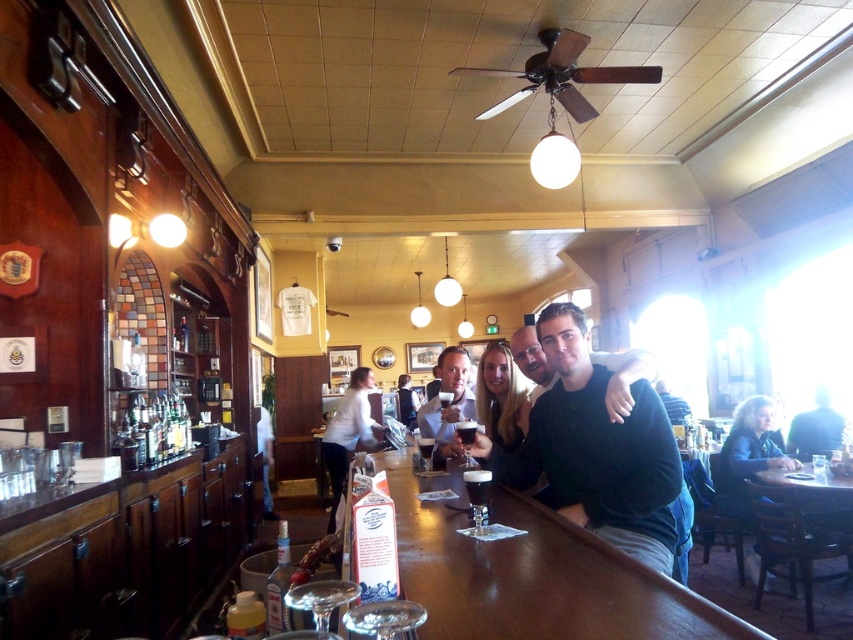
You are a bartender who needs to hand a drink to both the white matte shirt at bar and the matte black shirt at center. Which customer should you serve first if you want to minimize the distance walked?

The white matte shirt at bar is closer to you than the matte black shirt at center, so you should serve the white matte shirt at bar first to minimize the distance walked.

You are a bartender who needs to place a 3.5 feet long bottle on the bar. You see the transparent glass at bar front and the clear glass wine glass at bar center. Can you fit the bottle between them?

The transparent glass at bar front and clear glass wine glass at bar center are 3.66 feet apart, so yes, the 3.5 feet long bottle can fit between them since the distance is slightly longer than the bottle.